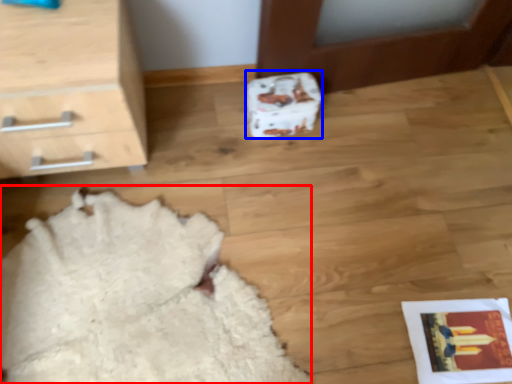
Question: Which object appears closest to the camera in this image, blanket (highlighted by a red box) or shoe box (highlighted by a blue box)?

Choices:
 (A) blanket
 (B) shoe box

Answer: (A)